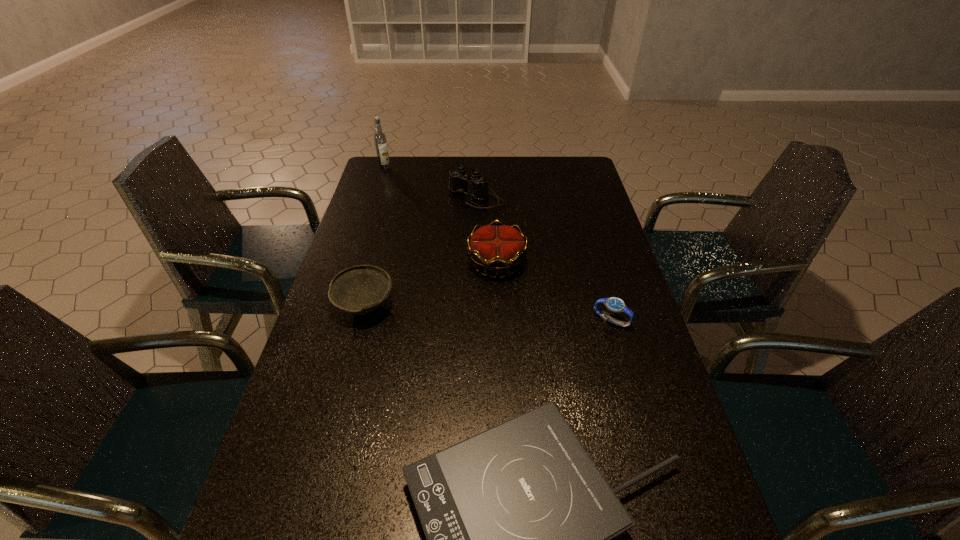
At what (x,y) coordinates should I click in order to perform the action: click on the farthest object. Please return your answer as a coordinate pair (x, y). Looking at the image, I should click on (380, 138).

I want to click on vodka, so click(x=380, y=138).

Where is `the second farthest object`? the second farthest object is located at coordinates (458, 179).

Identify the location of the third farthest object. (500, 248).

Identify the location of bowl. (361, 289).

Locate an element on the screen. The width and height of the screenshot is (960, 540). watch is located at coordinates (614, 304).

What are the coordinates of `vacant space located 0.380m on the label of the tallest object` in the screenshot? It's located at (366, 227).

Where is `blank space located on the back of the binoculars`? blank space located on the back of the binoculars is located at coordinates (476, 159).

The height and width of the screenshot is (540, 960). In order to click on blank space located on the back of the third farthest object in this screenshot , I will do `click(494, 202)`.

Image resolution: width=960 pixels, height=540 pixels. Find the location of `vacant area located 0.190m on the front of the bowl`. vacant area located 0.190m on the front of the bowl is located at coordinates (x=343, y=391).